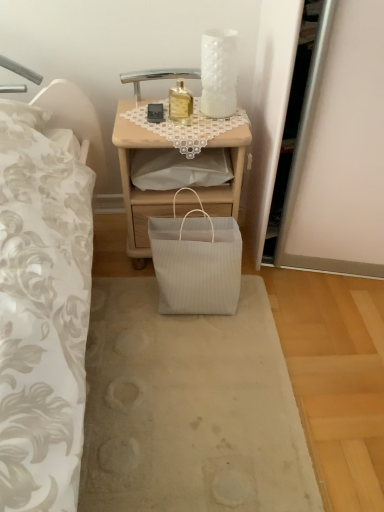
Question: Choose the correct answer: Is woodennightstand at center inside gold glass bottle at upper center or outside it?

Choices:
 (A) inside
 (B) outside

Answer: (B)

Question: From the image's perspective, is woodennightstand at center above or below gold glass bottle at upper center?

Choices:
 (A) above
 (B) below

Answer: (B)

Question: Estimate the real-world distances between objects in this image. Which object is closer to the white ribbed paper bag at center?

Choices:
 (A) gold glass bottle at upper center
 (B) woodennightstand at center
 (C) white ribbed paper bag at lower center

Answer: (C)

Question: Which object is the farthest from the gold glass bottle at upper center?

Choices:
 (A) white ribbed paper bag at lower center
 (B) white ribbed paper bag at center
 (C) woodennightstand at center

Answer: (B)